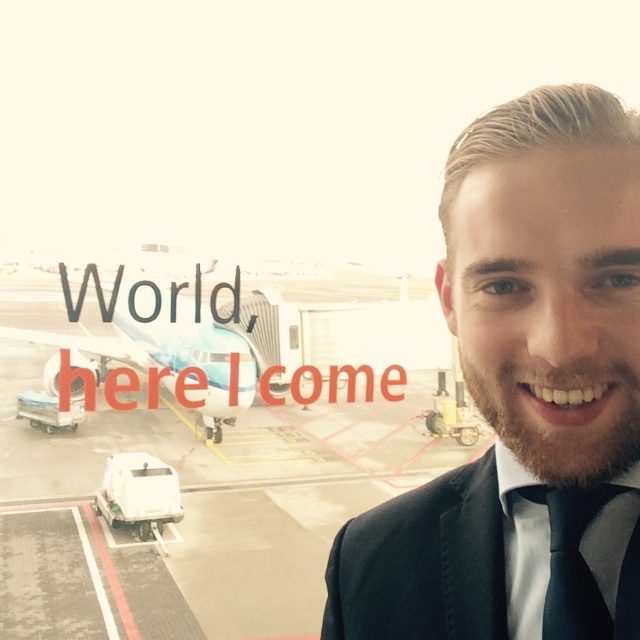
Question: Is the position of black suit at center more distant than that of black silk tie at right?

Choices:
 (A) no
 (B) yes

Answer: (A)

Question: Which point is closer to the camera?

Choices:
 (A) light blue metallic airplane at left
 (B) black satin business suit at right
 (C) black silk tie at right

Answer: (C)

Question: Which object is positioned closest to the black suit at center?

Choices:
 (A) light blue metallic airplane at left
 (B) black silk tie at right

Answer: (B)

Question: Which object is closer to the camera taking this photo?

Choices:
 (A) black suit at center
 (B) black satin business suit at right

Answer: (A)

Question: Does black suit at center appear on the left side of black satin business suit at right?

Choices:
 (A) no
 (B) yes

Answer: (A)

Question: Can you confirm if light blue metallic airplane at left is smaller than black silk tie at right?

Choices:
 (A) no
 (B) yes

Answer: (A)